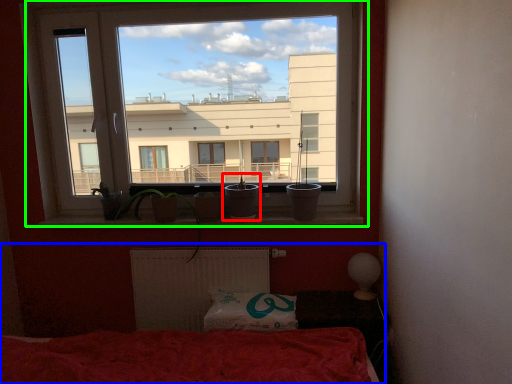
Question: Based on their relative distances, which object is nearer to houseplant (highlighted by a red box)? Choose from bed (highlighted by a blue box) and window (highlighted by a green box).

Choices:
 (A) bed
 (B) window

Answer: (A)